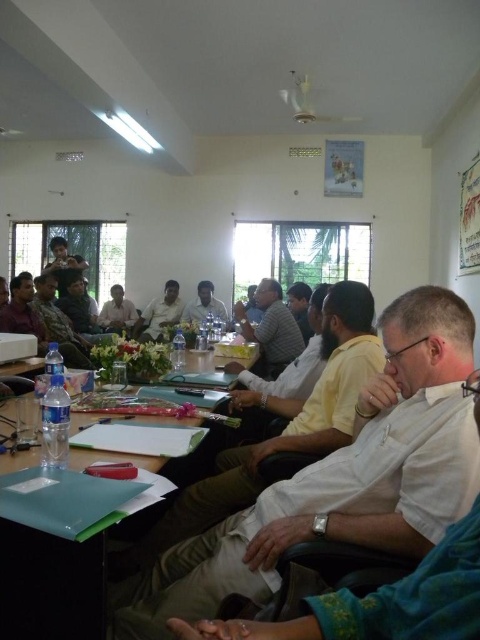
Question: Which point is farther from the camera taking this photo?

Choices:
 (A) (217, 310)
 (B) (201, 593)
 (C) (84, 346)

Answer: (A)

Question: Does white cotton shirt at center appear under matte black shirt at center?

Choices:
 (A) no
 (B) yes

Answer: (B)

Question: Is camouflage uniform at center above matte white shirt at center?

Choices:
 (A) no
 (B) yes

Answer: (A)

Question: Can you confirm if white cotton shirt at center is positioned below matte gray shirt at center?

Choices:
 (A) yes
 (B) no

Answer: (A)

Question: Which object is the closest to the green plastic folder at center?

Choices:
 (A) white cotton shirt at center
 (B) white glossy shirt at center

Answer: (A)

Question: Which point appears closest to the camera in this image?

Choices:
 (A) (55, 284)
 (B) (205, 301)

Answer: (A)